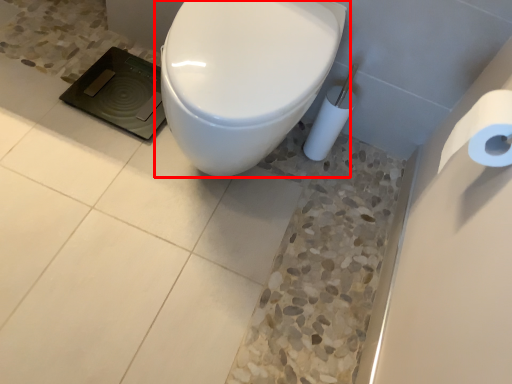
Question: In this image, where is toilet (annotated by the red box) located relative to toilet paper?

Choices:
 (A) right
 (B) left

Answer: (B)